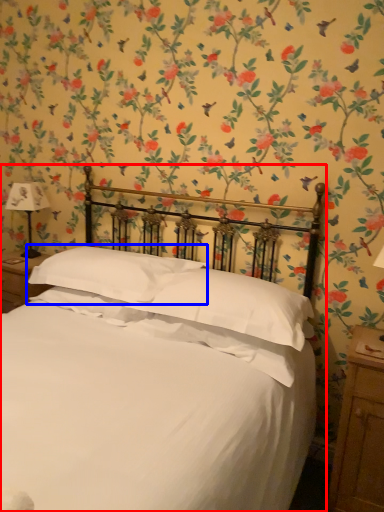
Question: Which object appears farthest to the camera in this image, bed (highlighted by a red box) or pillow (highlighted by a blue box)?

Choices:
 (A) bed
 (B) pillow

Answer: (B)